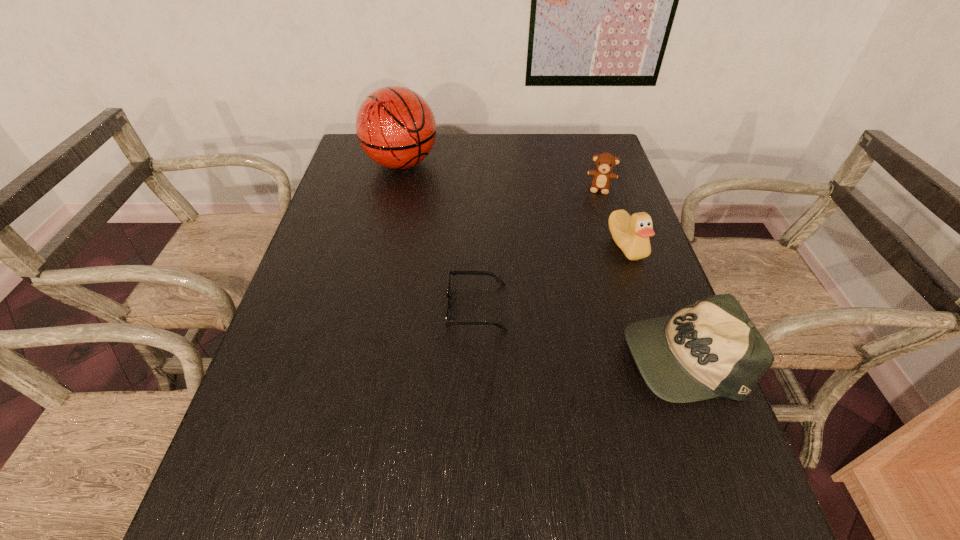
At what (x,y) coordinates should I click in order to perform the action: click on vacant space located on the front-facing side of the baseball cap. Please return your answer as a coordinate pair (x, y). Looking at the image, I should click on (519, 355).

Identify the location of vacant space located on the front-facing side of the baseball cap. (439, 355).

Find the location of `vacant space located on the front-facing side of the baseball cap`. vacant space located on the front-facing side of the baseball cap is located at coordinates (585, 355).

Find the location of a particular element. The height and width of the screenshot is (540, 960). vacant space located 0.090m on the side with spill of the tallest object is located at coordinates (431, 196).

Find the location of a particular element. Image resolution: width=960 pixels, height=540 pixels. free space located on the side with spill of the tallest object is located at coordinates (467, 234).

Locate an element on the screen. The height and width of the screenshot is (540, 960). free space located 0.300m on the side with spill of the tallest object is located at coordinates (467, 234).

Where is `free space located on the face of the teddy bear`? The image size is (960, 540). free space located on the face of the teddy bear is located at coordinates (592, 236).

Image resolution: width=960 pixels, height=540 pixels. I want to click on vacant region located 0.130m on the face of the teddy bear, so click(594, 220).

Where is `vacant space located 0.210m on the face of the teddy bear`? This screenshot has width=960, height=540. vacant space located 0.210m on the face of the teddy bear is located at coordinates (591, 238).

Image resolution: width=960 pixels, height=540 pixels. I want to click on vacant space located 0.250m at the beak of the third nearest object, so click(x=584, y=328).